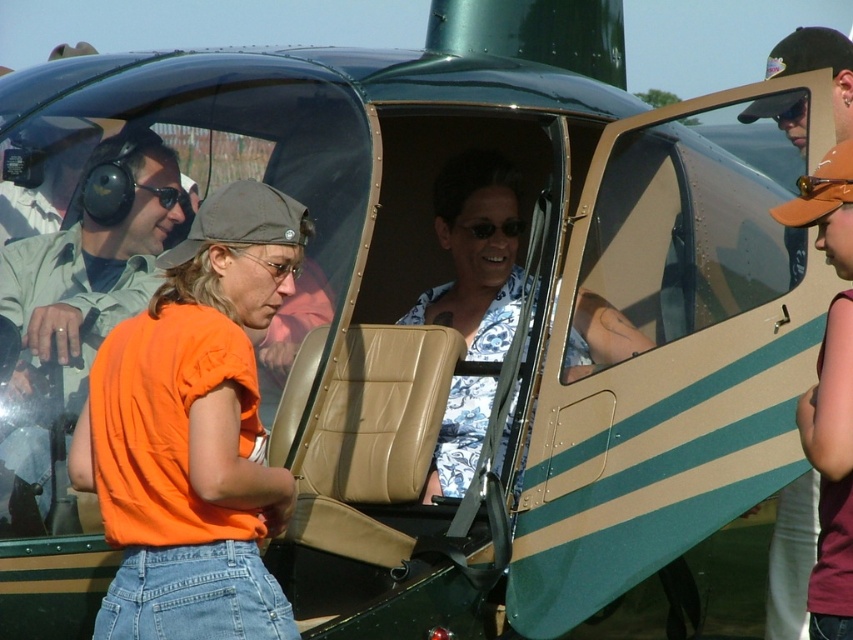
What do you see at coordinates (831, 474) in the screenshot? The height and width of the screenshot is (640, 853). I see `orange t-shirt at center` at bounding box center [831, 474].

Which of these two, orange t-shirt at center or shiny black sunglasses at center, stands shorter?

Standing shorter between the two is orange t-shirt at center.

Identify the location of orange t-shirt at center. (831, 474).

Identify the location of orange t-shirt at center. (831, 474).

Can you confirm if matte black goggles at center is positioned to the left of black rubber goggles at upper center?

Indeed, matte black goggles at center is positioned on the left side of black rubber goggles at upper center.

This screenshot has width=853, height=640. Describe the element at coordinates (270, 266) in the screenshot. I see `matte black goggles at center` at that location.

Between point (292, 275) and point (791, 115), which one is positioned behind?

Point (791, 115)

Where is `matte black goggles at center`? The width and height of the screenshot is (853, 640). matte black goggles at center is located at coordinates (270, 266).

Is point (834, 304) positioned before point (166, 209)?

No.

From the picture: Which of these two, orange t-shirt at center or black plastic sunglasses at upper center, stands taller?

With more height is black plastic sunglasses at upper center.

Which is behind, point (833, 570) or point (152, 186)?

The point (833, 570) is more distant.

I want to click on orange t-shirt at center, so click(x=831, y=474).